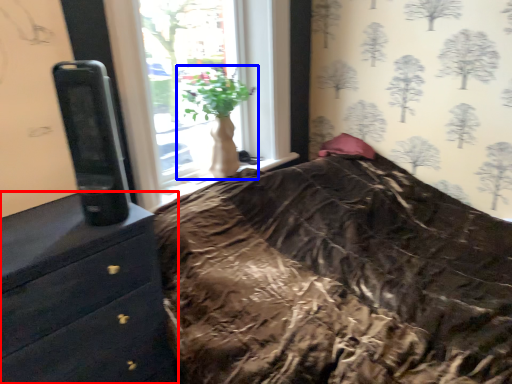
Question: Among these objects, which one is nearest to the camera, chest of drawers (highlighted by a red box) or houseplant (highlighted by a blue box)?

Choices:
 (A) chest of drawers
 (B) houseplant

Answer: (A)